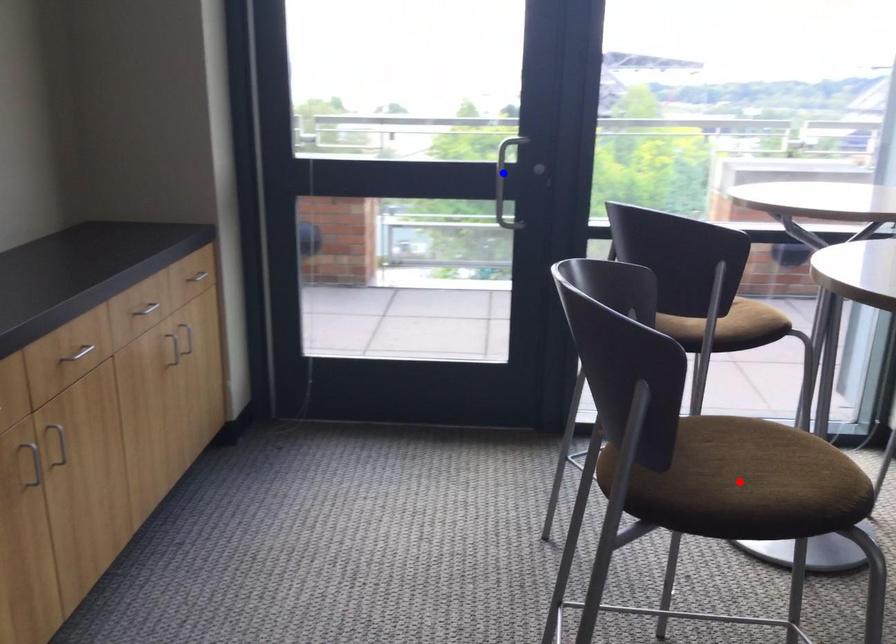
Question: Which of the two points in the image is closer to the camera?

Choices:
 (A) Blue point is closer.
 (B) Red point is closer.

Answer: (B)